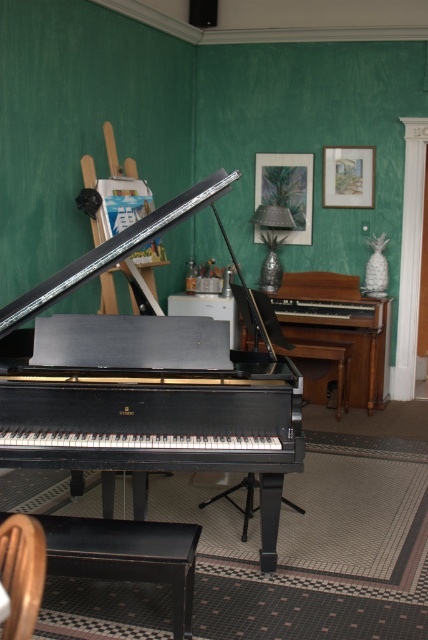
You are sitting on the wooden armchair at lower left and want to reach the wooden picture frame at upper center. Can you stretch your arm to touch it without moving from your seat?

The wooden armchair at lower left is closer to the viewer than the wooden picture frame at upper center, so the distance between them makes it impossible to touch the wooden picture frame at upper center by stretching your arm while sitting in the wooden armchair at lower left.

You are a piano teacher who wants to adjust the height of the bench to ensure proper posture for a student. Considering the height difference between the shiny black piano at center and the matte black bench at lower center, which object should you adjust and why?

The matte black bench at lower center should be adjusted because the shiny black piano at center is taller than it. To achieve proper posture, the bench height needs to be raised to match the piano height.

You are standing in the room and want to place a new lamp that is 10 feet long. The lamp needs to be placed at point (240, 449). Is there enough space between the lamp and the camera? Please answer based on the distance provided.

The distance of point (240, 449) from the camera is 9.56 feet. Since the lamp is 10 feet long, placing it at this point would mean the lamp extends beyond the camera by approximately 0.44 feet. Therefore, there is not enough space between the lamp and the camera.